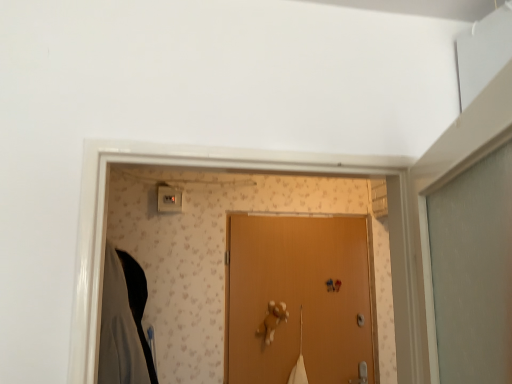
Image resolution: width=512 pixels, height=384 pixels. In order to click on empty space that is ontop of wooden door at center (from a real-world perspective) in this screenshot , I will do `click(302, 217)`.